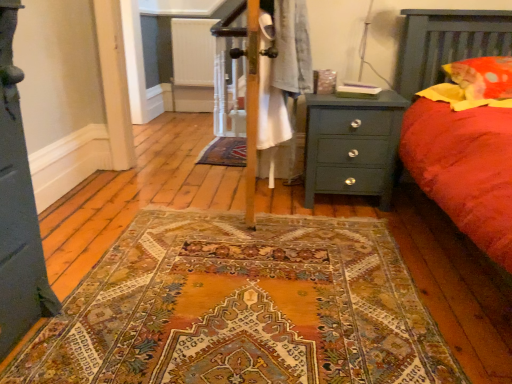
Question: In terms of height, does green matte nightstand at right look taller or shorter compared to white textured radiator at center?

Choices:
 (A) tall
 (B) short

Answer: (B)

Question: Relative to white textured radiator at center, is green matte nightstand at right in front or behind?

Choices:
 (A) front
 (B) behind

Answer: (A)

Question: Considering the real-world distances, which object is closest to the green matte nightstand at right?

Choices:
 (A) white textured radiator at center
 (B) red cotton pillow at upper right

Answer: (B)

Question: Which object is positioned closest to the red cotton pillow at upper right?

Choices:
 (A) white textured radiator at center
 (B) green matte nightstand at right

Answer: (B)